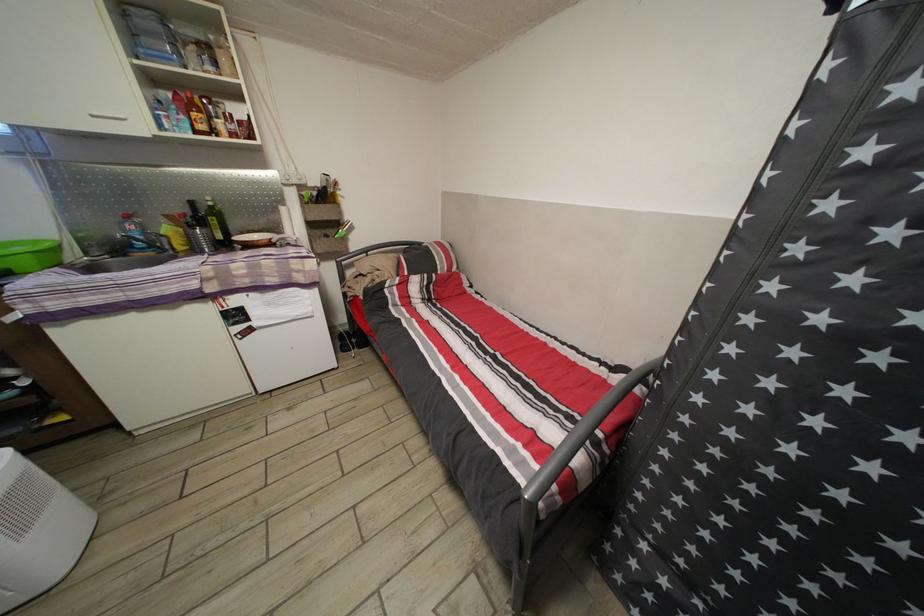
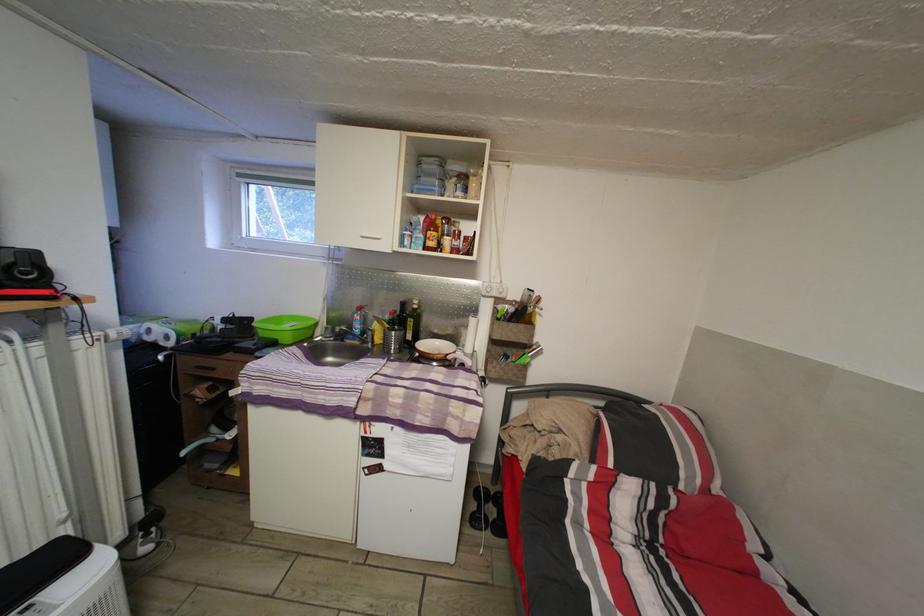
Question: The camera is either moving clockwise (left) or counter-clockwise (right) around the object. The first image is from the beginning of the video and the second image is from the end. Is the camera moving left or right when shooting the video?

Choices:
 (A) Left
 (B) Right

Answer: (B)